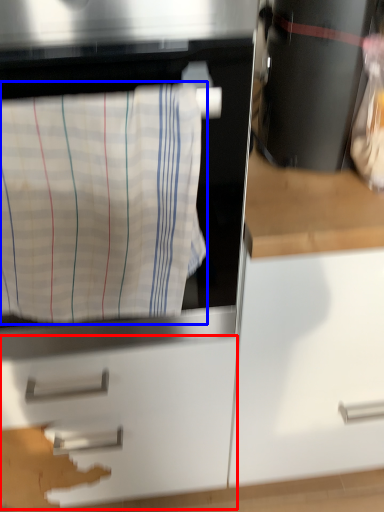
Question: Which point is further to the camera, drawer (highlighted by a red box) or laundry (highlighted by a blue box)?

Choices:
 (A) drawer
 (B) laundry

Answer: (A)